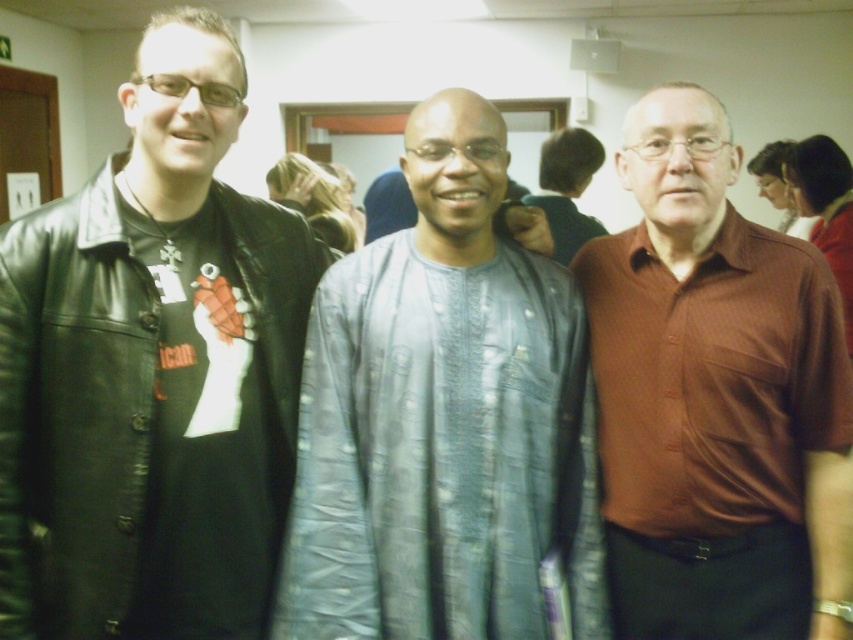
Question: Is brown smooth shirt at center behind gray textured shirt at center?

Choices:
 (A) yes
 (B) no

Answer: (B)

Question: Which point appears closest to the camera in this image?

Choices:
 (A) (94, 448)
 (B) (699, 628)
 (C) (560, 172)

Answer: (A)

Question: Considering the real-world distances, which object is closest to the silvery textured fabric at center?

Choices:
 (A) brown smooth shirt at center
 (B) black leather jacket at left

Answer: (A)

Question: In this image, where is brown smooth shirt at center located relative to gray textured shirt at center?

Choices:
 (A) right
 (B) left

Answer: (A)

Question: Considering the relative positions of silvery textured fabric at center and brown smooth shirt at center in the image provided, where is silvery textured fabric at center located with respect to brown smooth shirt at center?

Choices:
 (A) left
 (B) right

Answer: (A)

Question: Which object appears farthest from the camera in this image?

Choices:
 (A) gray textured shirt at center
 (B) brown smooth shirt at center

Answer: (A)